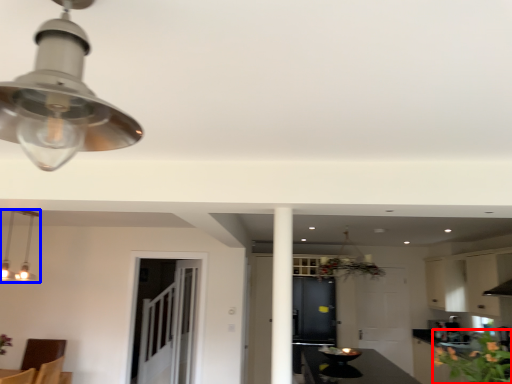
Question: Which object is further to the camera taking this photo, flower (highlighted by a red box) or lamp (highlighted by a blue box)?

Choices:
 (A) flower
 (B) lamp

Answer: (B)